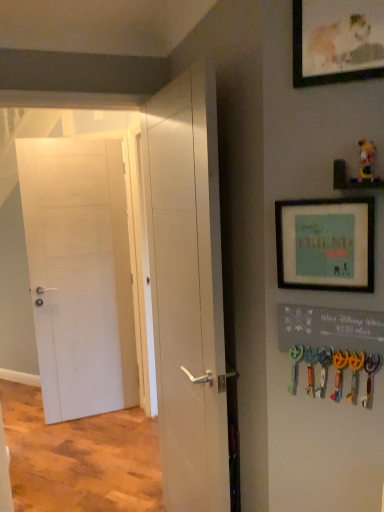
What do you see at coordinates (79, 274) in the screenshot? I see `white matte door at left, the first door in the left-to-right sequence` at bounding box center [79, 274].

How much space does white matte door at left, which is counted as the second door, starting from the front, occupy vertically?

white matte door at left, which is counted as the second door, starting from the front, is 6.55 feet in height.

How much space does teal matte picture frame at upper right, the 1th picture frame from the bottom, occupy horizontally?

The width of teal matte picture frame at upper right, the 1th picture frame from the bottom, is 1.67 inches.

At what (x,y) coordinates should I click in order to perform the action: click on matte wooden picture frame at upper right, positioned as the second picture frame in bottom-to-top order. Please return your answer as a coordinate pair (x, y). Looking at the image, I should click on (337, 41).

At what (x,y) coordinates should I click in order to perform the action: click on white matte door at left, the 2th door viewed from the right. Please return your answer as a coordinate pair (x, y). Looking at the image, I should click on click(79, 274).

Are white matte door at center, placed as the 2th door when sorted from back to front, and matte wooden picture frame at upper right, which is the 1th picture frame from top to bottom, far apart?

Actually, white matte door at center, placed as the 2th door when sorted from back to front, and matte wooden picture frame at upper right, which is the 1th picture frame from top to bottom, are a little close together.

Is white matte door at center, which is the second door in left-to-right order, behind matte wooden picture frame at upper right, which is the 1th picture frame from top to bottom?

That is True.

Considering the relative sizes of white matte door at center, arranged as the first door when viewed from the right, and matte wooden picture frame at upper right, which is the 1th picture frame from top to bottom, in the image provided, is white matte door at center, arranged as the first door when viewed from the right, shorter than matte wooden picture frame at upper right, which is the 1th picture frame from top to bottom,?

In fact, white matte door at center, arranged as the first door when viewed from the right, may be taller than matte wooden picture frame at upper right, which is the 1th picture frame from top to bottom.

How far apart are white matte door at center, placed as the 2th door when sorted from back to front, and matte wooden picture frame at upper right, which is the 1th picture frame from top to bottom?

The distance of white matte door at center, placed as the 2th door when sorted from back to front, from matte wooden picture frame at upper right, which is the 1th picture frame from top to bottom, is 30.29 inches.

Image resolution: width=384 pixels, height=512 pixels. What are the coordinates of `the 1st picture frame in front of the white matte door at center, placed as the 2th door when sorted from back to front, counting from the anchor's position` in the screenshot? It's located at (326, 244).

Between white matte door at center, which is the 1th door in front-to-back order, and teal matte picture frame at upper right, which appears as the second picture frame when viewed from the top, which one has larger size?

Bigger between the two is white matte door at center, which is the 1th door in front-to-back order.

Is white matte door at center, which is the 1th door in front-to-back order, thinner than teal matte picture frame at upper right, the 1th picture frame from the bottom?

No.

Which object is further away from the camera taking this photo, matte wooden picture frame at upper right, which is the 1th picture frame from top to bottom, or white matte door at left, the first door in the left-to-right sequence?

white matte door at left, the first door in the left-to-right sequence.

Is matte wooden picture frame at upper right, which is the 1th picture frame from top to bottom, next to white matte door at left, the first door in the left-to-right sequence, and touching it?

No, matte wooden picture frame at upper right, which is the 1th picture frame from top to bottom, is not touching white matte door at left, the first door in the left-to-right sequence.

Consider the image. Considering the relative sizes of matte wooden picture frame at upper right, which is the 1th picture frame from top to bottom, and white matte door at left, the first door in the left-to-right sequence, in the image provided, is matte wooden picture frame at upper right, which is the 1th picture frame from top to bottom, thinner than white matte door at left, the first door in the left-to-right sequence,?

Yes.

Where is `the 1st door positioned below the matte wooden picture frame at upper right, which is the 1th picture frame from top to bottom (from the image's perspective)`? the 1st door positioned below the matte wooden picture frame at upper right, which is the 1th picture frame from top to bottom (from the image's perspective) is located at coordinates (79, 274).

Is white matte door at left, which is counted as the first door, starting from the back, not close to teal matte picture frame at upper right, which appears as the second picture frame when viewed from the top?

Yes, white matte door at left, which is counted as the first door, starting from the back, and teal matte picture frame at upper right, which appears as the second picture frame when viewed from the top, are quite far apart.

Measure the distance between white matte door at left, the 2th door viewed from the right, and teal matte picture frame at upper right, the 1th picture frame from the bottom.

white matte door at left, the 2th door viewed from the right, is 6.91 feet away from teal matte picture frame at upper right, the 1th picture frame from the bottom.

Considering the sizes of objects white matte door at left, the first door in the left-to-right sequence, and teal matte picture frame at upper right, which appears as the second picture frame when viewed from the top, in the image provided, who is thinner, white matte door at left, the first door in the left-to-right sequence, or teal matte picture frame at upper right, which appears as the second picture frame when viewed from the top,?

teal matte picture frame at upper right, which appears as the second picture frame when viewed from the top, is thinner.

From a real-world perspective, is white matte door at left, the 2th door viewed from the right, under teal matte picture frame at upper right, the 1th picture frame from the bottom?

Yes.

From a real-world perspective, is white matte door at center, which is the second door in left-to-right order, physically above white matte door at left, the first door in the left-to-right sequence?

Yes, from a real-world perspective, white matte door at center, which is the second door in left-to-right order, is over white matte door at left, the first door in the left-to-right sequence

Does white matte door at center, which is the 1th door in front-to-back order, have a smaller size compared to white matte door at left, the first door in the left-to-right sequence?

Actually, white matte door at center, which is the 1th door in front-to-back order, might be larger than white matte door at left, the first door in the left-to-right sequence.

Can you confirm if white matte door at center, which is the 1th door in front-to-back order, is wider than white matte door at left, the first door in the left-to-right sequence?

Correct, the width of white matte door at center, which is the 1th door in front-to-back order, exceeds that of white matte door at left, the first door in the left-to-right sequence.

How different are the orientations of white matte door at center, placed as the 2th door when sorted from back to front, and white matte door at left, the first door in the left-to-right sequence, in degrees?

89.4 degrees.

Identify the location of door behind the white matte door at center, arranged as the first door when viewed from the right. (79, 274).

From a real-world perspective, is white matte door at left, which is counted as the second door, starting from the front, under white matte door at center, which is the second door in left-to-right order?

Indeed, from a real-world perspective, white matte door at left, which is counted as the second door, starting from the front, is positioned beneath white matte door at center, which is the second door in left-to-right order.

Considering the positions of point (81, 188) and point (202, 411), is point (81, 188) closer or farther from the camera than point (202, 411)?

Point (81, 188).

Visually, is white matte door at left, the 2th door viewed from the right, positioned to the left or to the right of white matte door at center, arranged as the first door when viewed from the right?

From the image, it's evident that white matte door at left, the 2th door viewed from the right, is to the left of white matte door at center, arranged as the first door when viewed from the right.

Is white matte door at center, arranged as the first door when viewed from the right, at the back of plush yellow bear at upper right?

No, plush yellow bear at upper right's orientation is not away from white matte door at center, arranged as the first door when viewed from the right.

Considering the positions of point (364, 160) and point (217, 356), is point (364, 160) closer or farther from the camera than point (217, 356)?

Point (364, 160) appears to be closer to the viewer than point (217, 356).

Is white matte door at center, arranged as the first door when viewed from the right, completely or partially inside plush yellow bear at upper right?

No, white matte door at center, arranged as the first door when viewed from the right, is not surrounded by plush yellow bear at upper right.

Which is behind, plush yellow bear at upper right or white matte door at center, placed as the 2th door when sorted from back to front?

white matte door at center, placed as the 2th door when sorted from back to front, is behind.

This screenshot has height=512, width=384. I want to click on door that is the 1st one when counting leftward from the matte wooden picture frame at upper right, positioned as the second picture frame in bottom-to-top order, so click(x=188, y=290).

From the image's perspective, starting from the white matte door at center, arranged as the first door when viewed from the right, which picture frame is the 1st one above? Please provide its 2D coordinates.

[(326, 244)]

Based on their spatial positions, is teal matte picture frame at upper right, which appears as the second picture frame when viewed from the top, or white matte door at center, which is the second door in left-to-right order, closer to plush yellow bear at upper right?

teal matte picture frame at upper right, which appears as the second picture frame when viewed from the top, is positioned closer to the anchor plush yellow bear at upper right.

Considering their positions, is plush yellow bear at upper right positioned closer to white matte door at left, which is counted as the second door, starting from the front, than white matte door at center, which is the second door in left-to-right order?

white matte door at center, which is the second door in left-to-right order, lies closer to white matte door at left, which is counted as the second door, starting from the front, than the other object.

Estimate the real-world distances between objects in this image. Which object is further from teal matte picture frame at upper right, the 1th picture frame from the bottom, plush yellow bear at upper right or white matte door at left, which is counted as the second door, starting from the front?

Among the two, white matte door at left, which is counted as the second door, starting from the front, is located further to teal matte picture frame at upper right, the 1th picture frame from the bottom.

Which object lies further to the anchor point teal matte picture frame at upper right, which appears as the second picture frame when viewed from the top, white matte door at center, which is the 1th door in front-to-back order, or plush yellow bear at upper right?

white matte door at center, which is the 1th door in front-to-back order.

From the image, which object appears to be farther from plush yellow bear at upper right, matte wooden picture frame at upper right, positioned as the second picture frame in bottom-to-top order, or teal matte picture frame at upper right, which appears as the second picture frame when viewed from the top?

matte wooden picture frame at upper right, positioned as the second picture frame in bottom-to-top order, lies further to plush yellow bear at upper right than the other object.

Looking at the image, which one is located closer to white matte door at left, which is counted as the first door, starting from the back, matte wooden picture frame at upper right, positioned as the second picture frame in bottom-to-top order, or plush yellow bear at upper right?

matte wooden picture frame at upper right, positioned as the second picture frame in bottom-to-top order, lies closer to white matte door at left, which is counted as the first door, starting from the back, than the other object.

Based on the photo, looking at the image, which one is located closer to white matte door at center, arranged as the first door when viewed from the right, teal matte picture frame at upper right, which appears as the second picture frame when viewed from the top, or white matte door at left, the first door in the left-to-right sequence?

teal matte picture frame at upper right, which appears as the second picture frame when viewed from the top.

Looking at the image, which one is located further to plush yellow bear at upper right, white matte door at center, which is the 1th door in front-to-back order, or matte wooden picture frame at upper right, positioned as the second picture frame in bottom-to-top order?

white matte door at center, which is the 1th door in front-to-back order, is further to plush yellow bear at upper right.

Identify the location of picture frame between matte wooden picture frame at upper right, positioned as the second picture frame in bottom-to-top order, and white matte door at center, arranged as the first door when viewed from the right, in the up-down direction. (326, 244).

Locate an element on the screen. The height and width of the screenshot is (512, 384). door positioned between teal matte picture frame at upper right, which appears as the second picture frame when viewed from the top, and white matte door at left, the 2th door viewed from the right, from near to far is located at coordinates (188, 290).

Locate an element on the screen. This screenshot has height=512, width=384. picture frame between plush yellow bear at upper right and white matte door at left, which is counted as the first door, starting from the back, from front to back is located at coordinates (326, 244).

The width and height of the screenshot is (384, 512). I want to click on door positioned between plush yellow bear at upper right and white matte door at left, which is counted as the first door, starting from the back, from near to far, so click(188, 290).